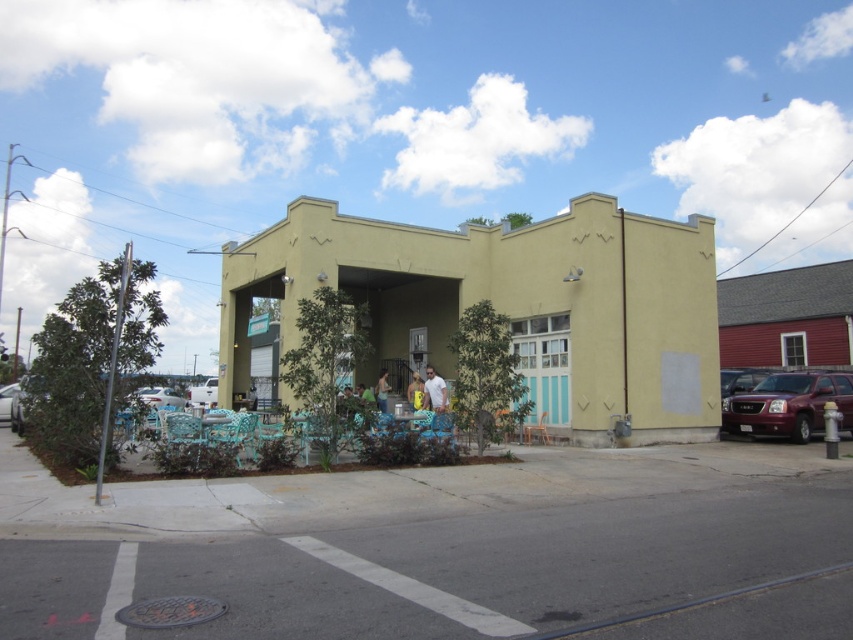
Question: Which of the following is the closest to the observer?

Choices:
 (A) (167, 400)
 (B) (0, 420)

Answer: (B)

Question: Does metallic maroon suv at right appear on the right side of white matte truck at left?

Choices:
 (A) no
 (B) yes

Answer: (B)

Question: Is yellow stucco building at center smaller than silver metallic car at left?

Choices:
 (A) no
 (B) yes

Answer: (A)

Question: From the image, what is the correct spatial relationship of metallic maroon suv at right in relation to white glossy car at lower left?

Choices:
 (A) right
 (B) left

Answer: (A)

Question: Which point appears farthest from the camera in this image?

Choices:
 (A) (170, 388)
 (B) (193, 400)
 (C) (4, 413)
 (D) (799, 378)

Answer: (A)

Question: Among these points, which one is nearest to the camera?

Choices:
 (A) (839, 397)
 (B) (204, 397)

Answer: (A)